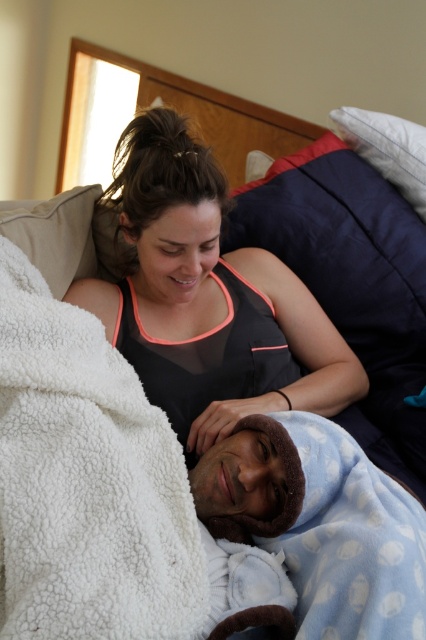
Question: Estimate the real-world distances between objects in this image. Which object is farther from the black mesh tank top at center?

Choices:
 (A) blue fleece blanket at lower right
 (B) beige soft pillow at upper left
 (C) white fluffy blanket at upper left
 (D) dark blue fabric pillow at upper right

Answer: (D)

Question: In this image, where is white fluffy blanket at upper left located relative to navy blue pillow at upper right?

Choices:
 (A) left
 (B) right

Answer: (A)

Question: Where is navy blue pillow at upper right located in relation to blue fleece blanket at lower right in the image?

Choices:
 (A) right
 (B) left

Answer: (A)

Question: Is beige soft pillow at upper left below dark blue fabric pillow at upper right?

Choices:
 (A) yes
 (B) no

Answer: (A)

Question: Which object is positioned farthest from the dark blue fabric pillow at upper right?

Choices:
 (A) white fluffy blanket at upper left
 (B) beige soft pillow at upper left
 (C) blue fleece blanket at lower right
 (D) black mesh tank top at center

Answer: (A)

Question: Which object appears farthest from the camera in this image?

Choices:
 (A) dark blue fabric pillow at upper right
 (B) navy blue pillow at upper right
 (C) white fluffy blanket at upper left
 (D) blue fleece blanket at lower right

Answer: (A)